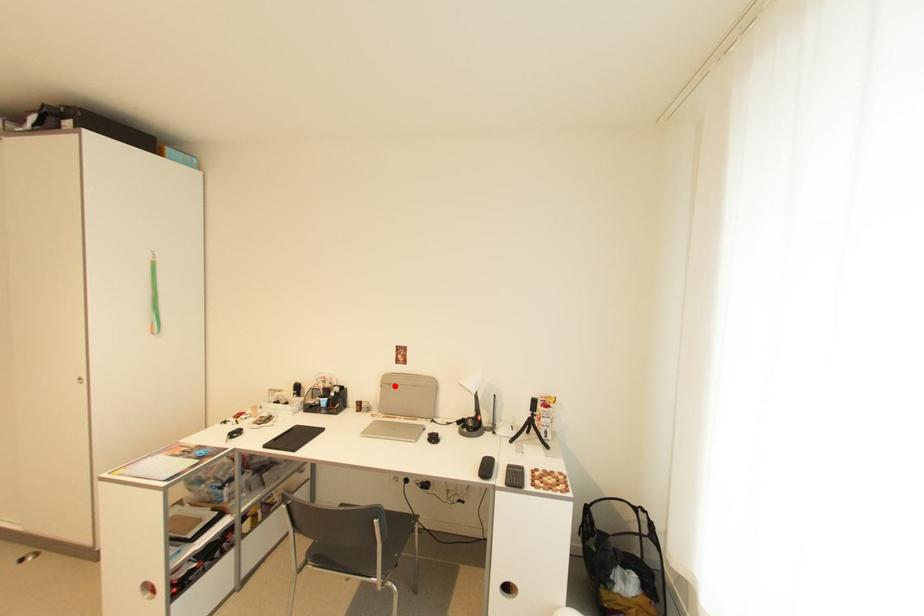
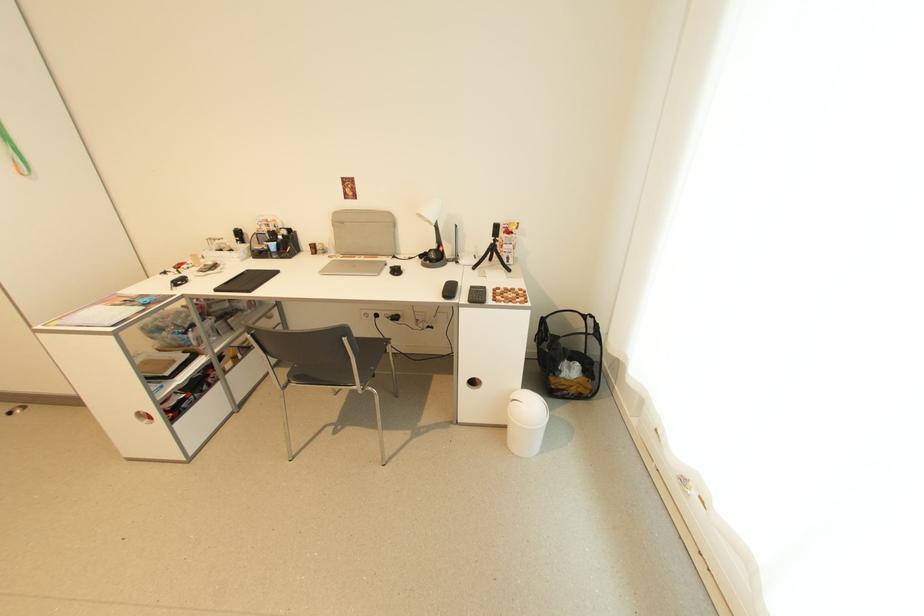
Question: I am providing you with two images of the same scene from different viewpoints. Image1 has a red point marked. In image2, the corresponding 3D location appears at what relative position? Reply with the corresponding letter.

Choices:
 (A) Closer
 (B) Farther

Answer: (A)